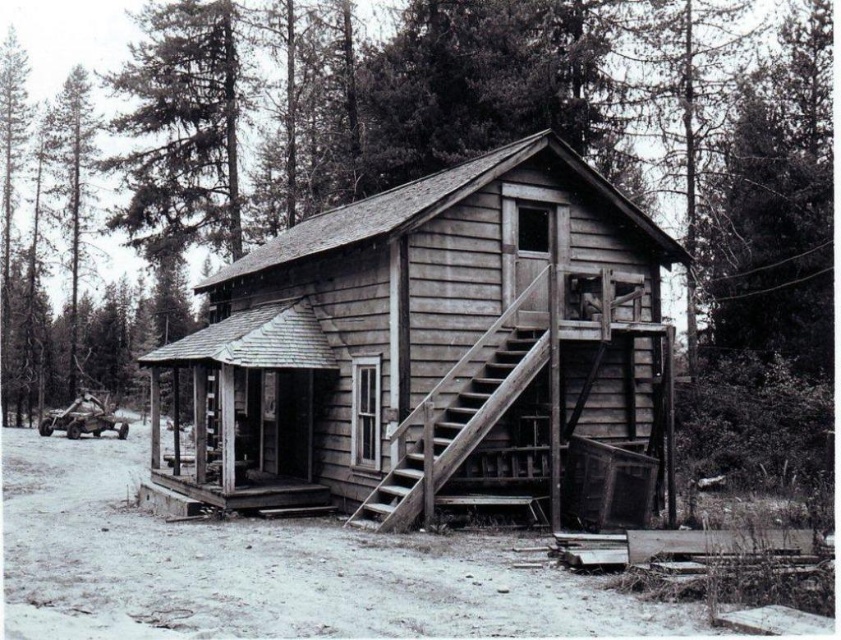
You are standing at the point marked by the coordinate point at (438, 349). Based on the scene description, what object are you directly in front of?

The point at (438, 349) marks the weathered wood cabin at center, so you are directly in front of the weathered wood cabin at center.

You are standing at the base of the weathered wood stairs at center leading to the weathered wood cabin at center. Which object is higher in elevation?

The weathered wood cabin at center is higher in elevation than the weathered wood stairs at center because it is positioned above them.